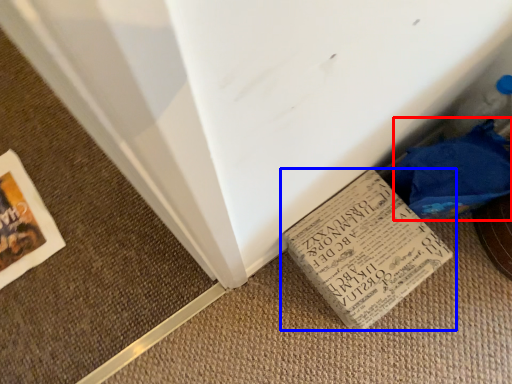
Question: Which of the following is the farthest to the observer, material (highlighted by a red box) or book (highlighted by a blue box)?

Choices:
 (A) material
 (B) book

Answer: (B)